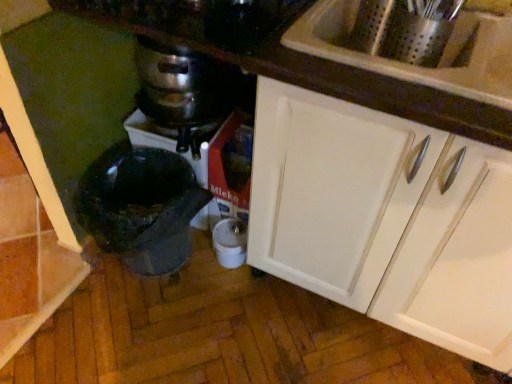
Question: Does white glossy cabinet at upper right have a lesser width compared to white plastic container at lower center, the first appliance in the right-to-left sequence?

Choices:
 (A) yes
 (B) no

Answer: (B)

Question: Can you see white glossy cabinet at upper right touching white plastic container at lower center, marked as the 2th appliance in a left-to-right arrangement?

Choices:
 (A) no
 (B) yes

Answer: (A)

Question: Can you confirm if white glossy cabinet at upper right is taller than white plastic container at lower center, marked as the 2th appliance in a left-to-right arrangement?

Choices:
 (A) yes
 (B) no

Answer: (A)

Question: Does white glossy cabinet at upper right appear on the left side of white plastic container at lower center, marked as the 2th appliance in a left-to-right arrangement?

Choices:
 (A) no
 (B) yes

Answer: (A)

Question: From a real-world perspective, is white glossy cabinet at upper right on top of white plastic container at lower center, marked as the 2th appliance in a left-to-right arrangement?

Choices:
 (A) no
 (B) yes

Answer: (B)

Question: Is white plastic container at lower center, the first appliance in the right-to-left sequence, taller or shorter than white glossy cabinet at upper right?

Choices:
 (A) tall
 (B) short

Answer: (B)

Question: Looking at the image, does white plastic container at lower center, the first appliance in the right-to-left sequence, seem bigger or smaller compared to white glossy cabinet at upper right?

Choices:
 (A) small
 (B) big

Answer: (A)

Question: Would you say white plastic container at lower center, the first appliance in the right-to-left sequence, is inside or outside white glossy cabinet at upper right?

Choices:
 (A) outside
 (B) inside

Answer: (A)

Question: In terms of width, does white plastic container at lower center, marked as the 2th appliance in a left-to-right arrangement, look wider or thinner when compared to white glossy cabinet at upper right?

Choices:
 (A) wide
 (B) thin

Answer: (B)

Question: Based on their sizes in the image, would you say stainless steel pot at center is bigger or smaller than white glossy sink at upper right?

Choices:
 (A) small
 (B) big

Answer: (A)

Question: From a real-world perspective, is stainless steel pot at center positioned above or below white glossy sink at upper right?

Choices:
 (A) below
 (B) above

Answer: (A)

Question: Considering the positions of stainless steel pot at center and white glossy sink at upper right in the image, is stainless steel pot at center taller or shorter than white glossy sink at upper right?

Choices:
 (A) short
 (B) tall

Answer: (A)

Question: Would you say stainless steel pot at center is inside or outside white glossy sink at upper right?

Choices:
 (A) inside
 (B) outside

Answer: (B)

Question: In the image, is white glossy cabinet at upper right on the left side or the right side of stainless steel pot at center?

Choices:
 (A) left
 (B) right

Answer: (B)

Question: Is white glossy cabinet at upper right taller or shorter than stainless steel pot at center?

Choices:
 (A) short
 (B) tall

Answer: (B)